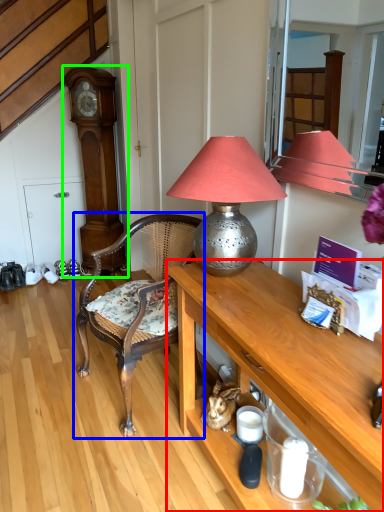
Question: Considering the real-world distances, which object is closest to desk (highlighted by a red box)? chair (highlighted by a blue box) or clock (highlighted by a green box).

Choices:
 (A) chair
 (B) clock

Answer: (A)